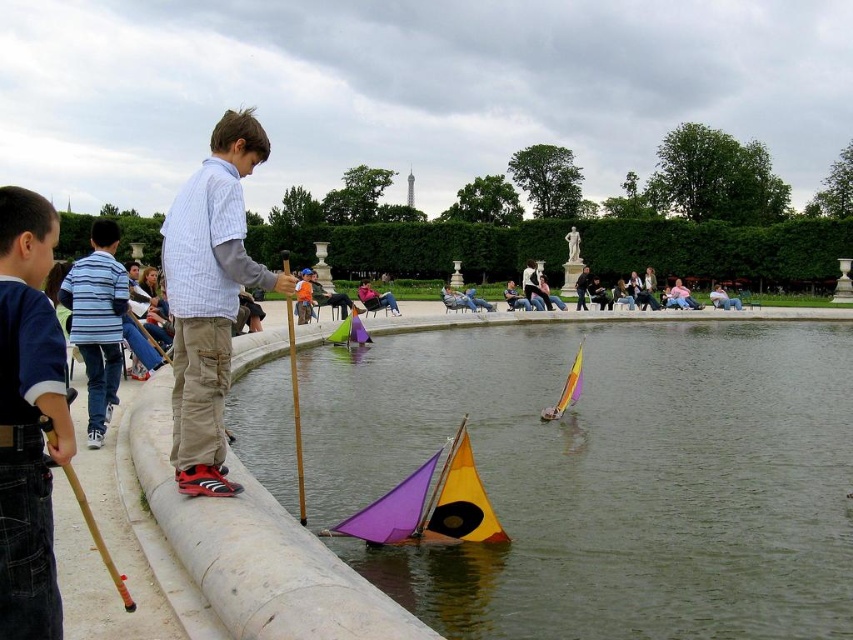
In the scene shown: Is transparent plastic water at center below matte plastic sailboat at center?

Incorrect, transparent plastic water at center is not positioned below matte plastic sailboat at center.

How far apart are transparent plastic water at center and matte plastic sailboat at center?

8.73 meters

Find the location of a particular element. transparent plastic water at center is located at coordinates (606, 476).

The width and height of the screenshot is (853, 640). Find the location of `transparent plastic water at center`. transparent plastic water at center is located at coordinates (606, 476).

Is point (398, 541) in front of point (77, 280)?

Yes, point (398, 541) is in front of point (77, 280).

Between point (451, 460) and point (111, 337), which one is positioned in front?

Point (451, 460) is more forward.

Is point (442, 499) farther from viewer compared to point (93, 282)?

No.

This screenshot has height=640, width=853. I want to click on matte plastic sailboat at center, so click(428, 504).

Is white striped shirt at center below rainbow plastic sailboat at center?

No.

Can you confirm if white striped shirt at center is taller than rainbow plastic sailboat at center?

Correct, white striped shirt at center is much taller as rainbow plastic sailboat at center.

Which is in front, point (227, 289) or point (581, 355)?

Point (227, 289)

Identify the location of white striped shirt at center. (209, 296).